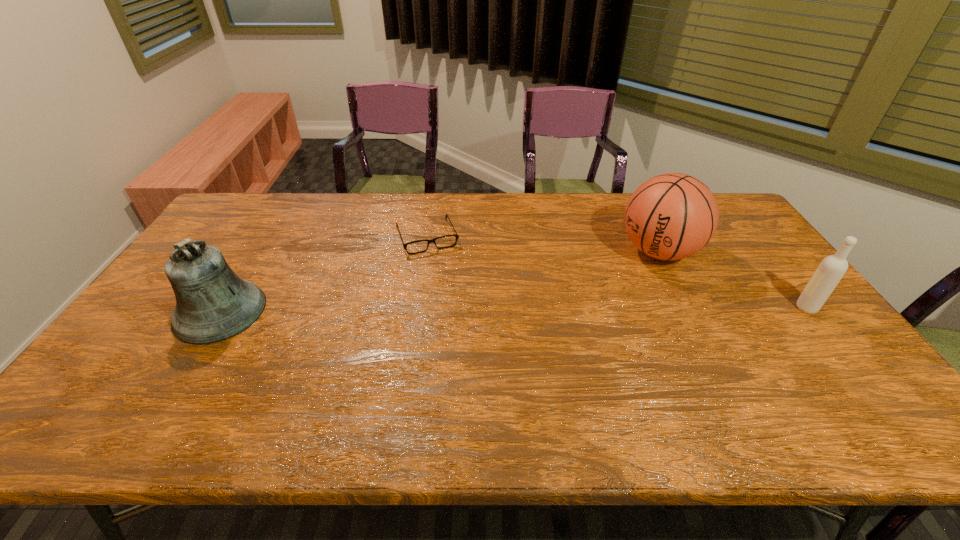
The height and width of the screenshot is (540, 960). In the image, there is a desktop. Find the location of `vacant space at the right edge`. vacant space at the right edge is located at coordinates (760, 307).

Find the location of a particular element. The width and height of the screenshot is (960, 540). vacant space at the far left corner of the desktop is located at coordinates point(228,217).

Locate an element on the screen. This screenshot has height=540, width=960. vacant point located between the second object from right to left and the bell is located at coordinates (440, 281).

Where is `vacant space that is in between the rightmost object and the bell`? The width and height of the screenshot is (960, 540). vacant space that is in between the rightmost object and the bell is located at coordinates (514, 309).

This screenshot has height=540, width=960. Find the location of `vacant area that lies between the basketball and the rightmost object`. vacant area that lies between the basketball and the rightmost object is located at coordinates (732, 280).

I want to click on unoccupied position between the shortest object and the third object from left to right, so click(543, 244).

Where is `free space between the third object from right to left and the third object from left to right`? free space between the third object from right to left and the third object from left to right is located at coordinates (543, 244).

Locate an element on the screen. The image size is (960, 540). free space between the second object from right to left and the rightmost object is located at coordinates (732, 280).

Locate an element on the screen. This screenshot has height=540, width=960. unoccupied position between the spectacles and the second object from right to left is located at coordinates (543, 244).

Identify the location of free space between the spectacles and the third object from left to right. The image size is (960, 540). (543, 244).